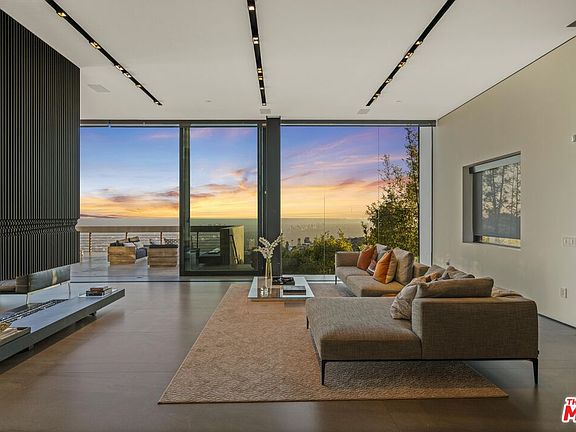
The height and width of the screenshot is (432, 576). Identify the location of brown couch. (358, 274), (391, 327).